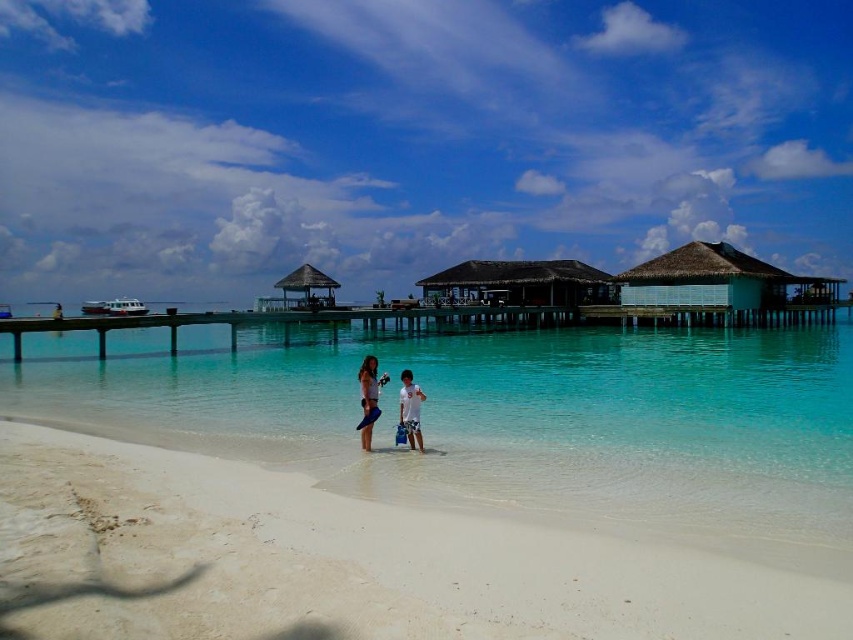
You are standing at the shoreline and want to walk towards the wooden pier. There are two points marked on the sand. One is at point (686, 273) and the other is at point (402, 390). Which point should you head towards to reach the pier first?

You should head towards point (402, 390) because it is in front of point (686, 273), so you will reach the pier faster by going to the closer point first.